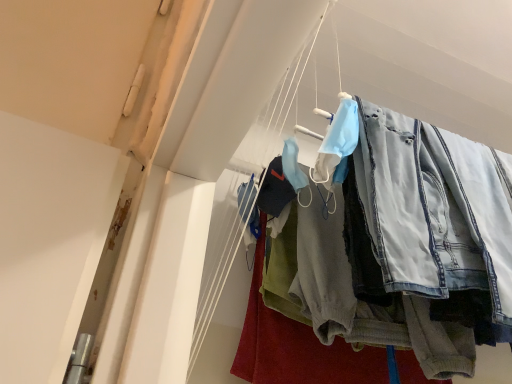
Image resolution: width=512 pixels, height=384 pixels. What are the coordinates of `denim pants at center` in the screenshot? It's located at (385, 254).

What do you see at coordinates (385, 254) in the screenshot?
I see `denim pants at center` at bounding box center [385, 254].

Identify the location of denim jeans at upper right. (435, 208).

What do you see at coordinates (435, 208) in the screenshot? This screenshot has width=512, height=384. I see `denim jeans at upper right` at bounding box center [435, 208].

Measure the distance between point (487,229) and camera.

A distance of 83.70 centimeters exists between point (487,229) and camera.

Where is `denim pants at center`? The height and width of the screenshot is (384, 512). denim pants at center is located at coordinates (385, 254).

Is denim pants at center at the left side of denim jeans at upper right?

Correct, you'll find denim pants at center to the left of denim jeans at upper right.

Considering the positions of objects denim pants at center and denim jeans at upper right in the image provided, who is in front, denim pants at center or denim jeans at upper right?

denim jeans at upper right is more forward.

Which is less distant, (482,278) or (454,213)?

Clearly, point (482,278) is closer to the camera than point (454,213).

From the image's perspective, would you say denim pants at center is positioned over denim jeans at upper right?

No.

From a real-world perspective, who is located higher, denim pants at center or denim jeans at upper right?

denim jeans at upper right.

Considering the relative sizes of denim pants at center and denim jeans at upper right in the image provided, is denim pants at center thinner than denim jeans at upper right?

No.

Who is taller, denim pants at center or denim jeans at upper right?

denim pants at center.

Between denim pants at center and denim jeans at upper right, which one has larger size?

With larger size is denim pants at center.

Is denim jeans at upper right completely or partially inside denim pants at center?

No, denim jeans at upper right is not surrounded by denim pants at center.

Is denim pants at center far from denim jeans at upper right?

That's not correct — denim pants at center is a little close to denim jeans at upper right.

Is denim pants at center looking in the opposite direction of denim jeans at upper right?

No, denim pants at center is not facing away from denim jeans at upper right.

How different are the orientations of denim pants at center and denim jeans at upper right in degrees?

denim pants at center and denim jeans at upper right are facing 0.000386 degrees away from each other.

Identify the location of trousers located on the left of denim jeans at upper right. This screenshot has height=384, width=512. (385, 254).

Considering the relative positions of denim jeans at upper right and denim pants at center in the image provided, is denim jeans at upper right to the left of denim pants at center from the viewer's perspective?

No.

Is denim jeans at upper right in front of or behind denim pants at center in the image?

denim jeans at upper right is in front of denim pants at center.

Which is behind, point (470, 166) or point (324, 365)?

The point (324, 365) is more distant.

In the scene shown: From the image's perspective, between denim jeans at upper right and denim pants at center, which one is located above?

denim jeans at upper right, from the image's perspective.

From a real-world perspective, between denim jeans at upper right and denim pants at center, who is vertically higher?

denim jeans at upper right, from a real-world perspective.

Considering the sizes of denim jeans at upper right and denim pants at center in the image, is denim jeans at upper right wider or thinner than denim pants at center?

In the image, denim jeans at upper right appears to be more narrow than denim pants at center.

Does denim jeans at upper right have a greater height compared to denim pants at center?

In fact, denim jeans at upper right may be shorter than denim pants at center.

Consider the image. Is denim jeans at upper right bigger or smaller than denim pants at center?

Clearly, denim jeans at upper right is smaller in size than denim pants at center.

Could denim pants at center be considered to be inside denim jeans at upper right?

No, denim pants at center is not inside denim jeans at upper right.

From the picture: Are denim jeans at upper right and denim pants at center making contact?

Indeed, denim jeans at upper right and denim pants at center are beside each other and touching.

Is denim jeans at upper right oriented away from denim pants at center?

Yes, denim jeans at upper right is positioned with its back facing denim pants at center.

What's the angular difference between denim jeans at upper right and denim pants at center's facing directions?

denim jeans at upper right and denim pants at center are facing 0.000386 degrees away from each other.

Measure the distance between denim jeans at upper right and denim pants at center.

3.45 inches.

Find the location of a particular element. The image size is (512, 384). clothing located above the denim pants at center (from a real-world perspective) is located at coordinates (435, 208).

Identify the location of clothing located on the right of denim pants at center. Image resolution: width=512 pixels, height=384 pixels. (435, 208).

Find the location of a particular element. The image size is (512, 384). clothing above the denim pants at center (from a real-world perspective) is located at coordinates (435, 208).